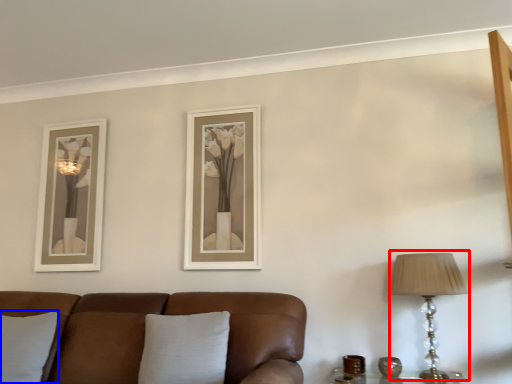
Question: Among these objects, which one is farthest to the camera, table lamp (highlighted by a red box) or pillow (highlighted by a blue box)?

Choices:
 (A) table lamp
 (B) pillow

Answer: (B)